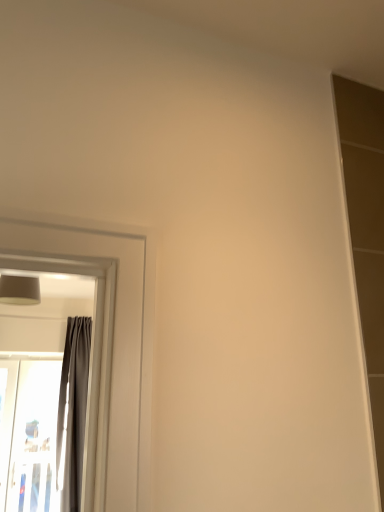
Question: Based on their sizes in the image, would you say transparent plastic screen door at left is bigger or smaller than matte gray lampshade at upper left?

Choices:
 (A) small
 (B) big

Answer: (B)

Question: From the image's perspective, is transparent plastic screen door at left positioned above or below matte gray lampshade at upper left?

Choices:
 (A) above
 (B) below

Answer: (B)

Question: Which object is the farthest from the gray fabric curtain at left?

Choices:
 (A) transparent plastic screen door at left
 (B) matte gray lampshade at upper left

Answer: (B)

Question: Considering the real-world distances, which object is farthest from the matte gray lampshade at upper left?

Choices:
 (A) gray fabric curtain at left
 (B) transparent plastic screen door at left

Answer: (B)